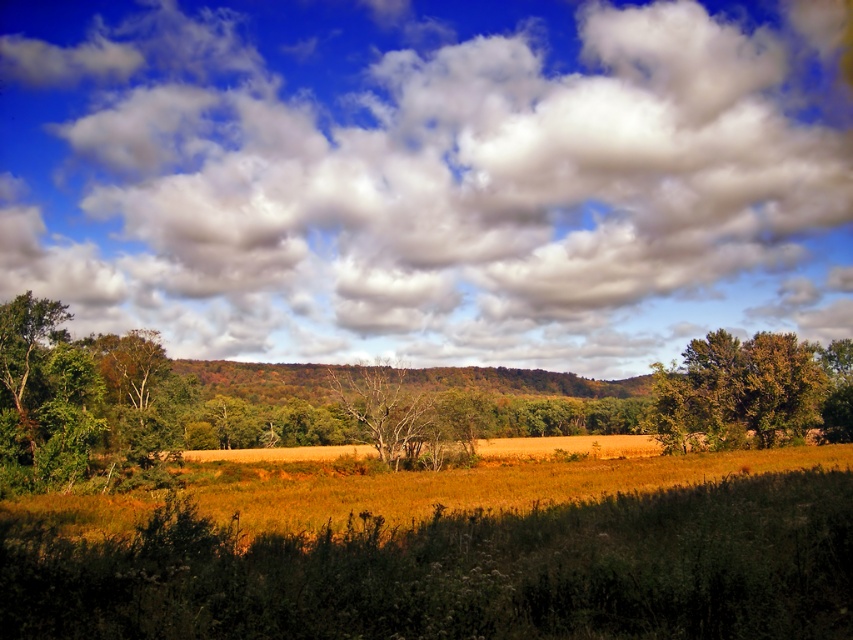
Who is positioned more to the left, green leafy tree at right or bare wood tree at center?

From the viewer's perspective, bare wood tree at center appears more on the left side.

Can you confirm if green leafy tree at right is shorter than bare wood tree at center?

Incorrect, green leafy tree at right's height does not fall short of bare wood tree at center's.

At what (x,y) coordinates should I click in order to perform the action: click on green leafy tree at right. Please return your answer as a coordinate pair (x, y). Image resolution: width=853 pixels, height=640 pixels. Looking at the image, I should click on (751, 388).

Looking at this image, can you confirm if white fluffy cloud at upper center is wider than bare wood tree at center?

Correct, the width of white fluffy cloud at upper center exceeds that of bare wood tree at center.

Between white fluffy cloud at upper center and bare wood tree at center, which one is positioned lower?

Positioned lower is bare wood tree at center.

Between point (532, 218) and point (398, 394), which one is positioned behind?

The point (532, 218) is behind.

Identify the location of white fluffy cloud at upper center. (428, 176).

Can you confirm if white fluffy cloud at upper center is shorter than green leafy tree at right?

In fact, white fluffy cloud at upper center may be taller than green leafy tree at right.

Is point (512, 156) closer to viewer compared to point (686, 372)?

No, it is behind (686, 372).

This screenshot has width=853, height=640. What are the coordinates of `white fluffy cloud at upper center` in the screenshot? It's located at (428, 176).